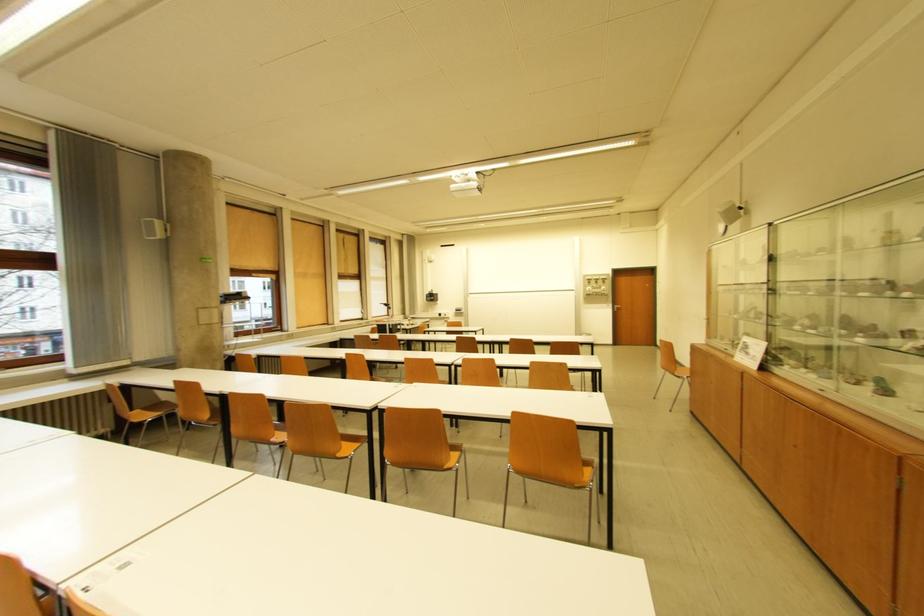
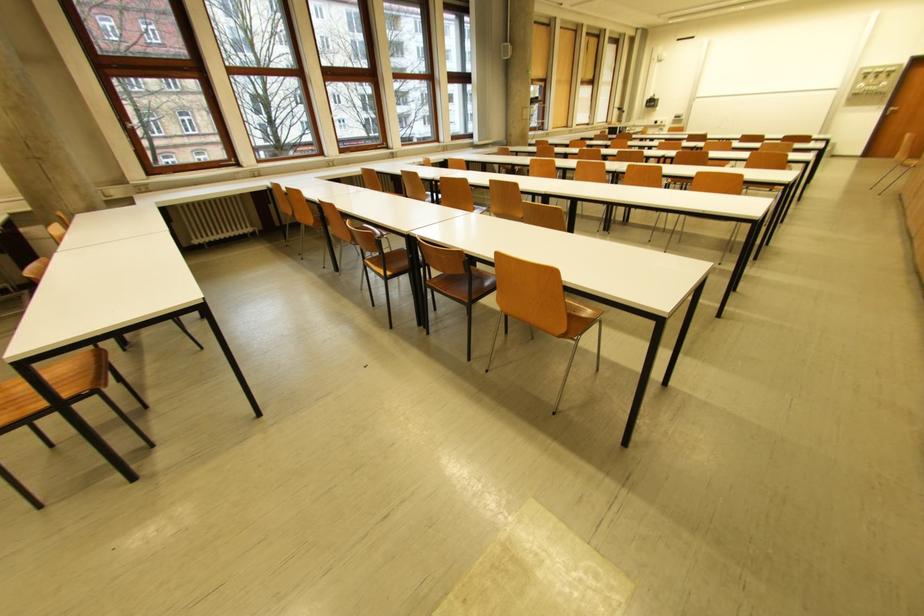
Locate, in the second image, the point that corresponds to the point at 606,283 in the first image.

(890, 77)